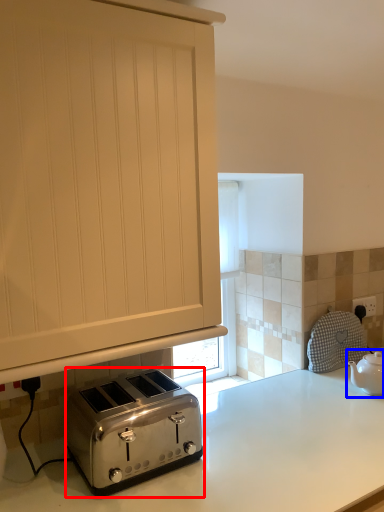
Question: Which of the following is the farthest to the observer, toaster (highlighted by a red box) or tea pot (highlighted by a blue box)?

Choices:
 (A) toaster
 (B) tea pot

Answer: (B)